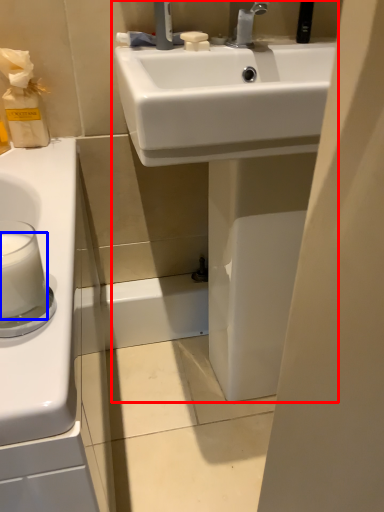
Question: Which point is closer to the camera, sink (highlighted by a red box) or milk (highlighted by a blue box)?

Choices:
 (A) sink
 (B) milk

Answer: (B)